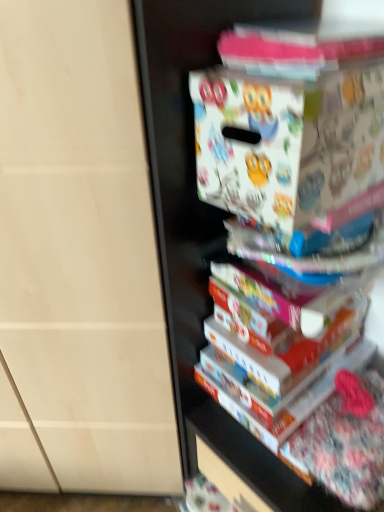
Question: Considering the positions of white glossy book at center and white matte board game box at upper right in the image, is white glossy book at center taller or shorter than white matte board game box at upper right?

Choices:
 (A) tall
 (B) short

Answer: (B)

Question: Considering the relative positions of white glossy book at center and white matte board game box at upper right in the image provided, is white glossy book at center to the left or to the right of white matte board game box at upper right?

Choices:
 (A) left
 (B) right

Answer: (B)

Question: In the image, is white glossy book at center positioned in front of or behind white matte board game box at upper right?

Choices:
 (A) behind
 (B) front

Answer: (A)

Question: Is white matte board game box at upper right in front of or behind white glossy book at center in the image?

Choices:
 (A) behind
 (B) front

Answer: (B)

Question: Is white matte board game box at upper right to the left or to the right of white glossy book at center in the image?

Choices:
 (A) right
 (B) left

Answer: (B)

Question: Is white matte board game box at upper right taller or shorter than white glossy book at center?

Choices:
 (A) short
 (B) tall

Answer: (B)

Question: From a real-world perspective, is white matte board game box at upper right physically located above or below white glossy book at center?

Choices:
 (A) above
 (B) below

Answer: (A)